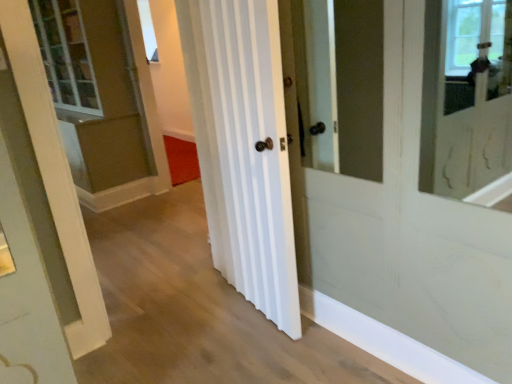
Question: Visually, is clear glass window at upper center positioned to the left or to the right of white striped door at center?

Choices:
 (A) right
 (B) left

Answer: (B)

Question: Considering the positions of clear glass window at upper center and white striped door at center in the image, is clear glass window at upper center taller or shorter than white striped door at center?

Choices:
 (A) short
 (B) tall

Answer: (A)

Question: Would you say clear glass window at upper center is inside or outside white striped door at center?

Choices:
 (A) outside
 (B) inside

Answer: (A)

Question: Choose the correct answer: Is white striped door at center inside clear glass window at upper center or outside it?

Choices:
 (A) outside
 (B) inside

Answer: (A)

Question: Considering the positions of white striped door at center and clear glass window at upper center in the image, is white striped door at center taller or shorter than clear glass window at upper center?

Choices:
 (A) short
 (B) tall

Answer: (B)

Question: From the image's perspective, is white striped door at center positioned above or below clear glass window at upper center?

Choices:
 (A) below
 (B) above

Answer: (A)

Question: From a real-world perspective, relative to clear glass window at upper center, is white striped door at center vertically above or below?

Choices:
 (A) above
 (B) below

Answer: (B)